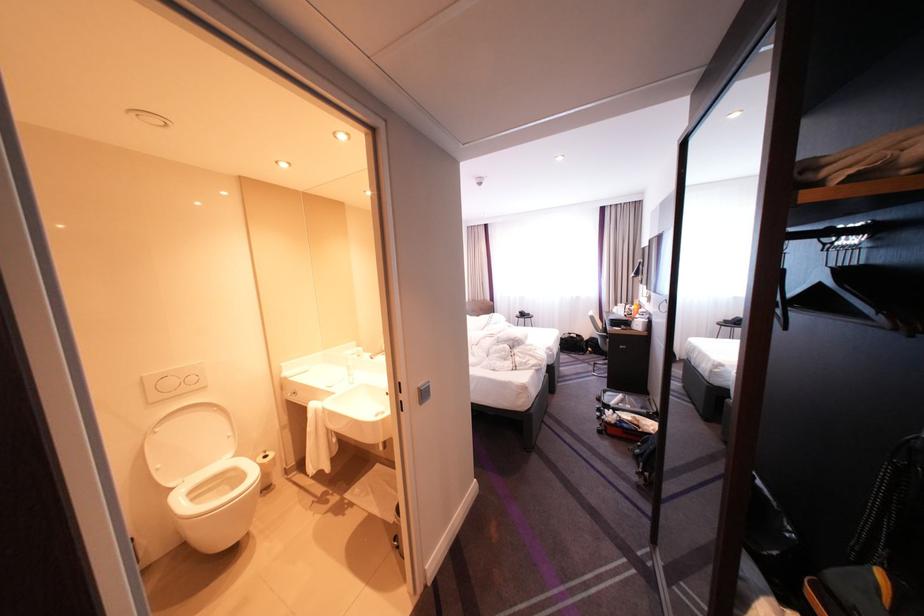
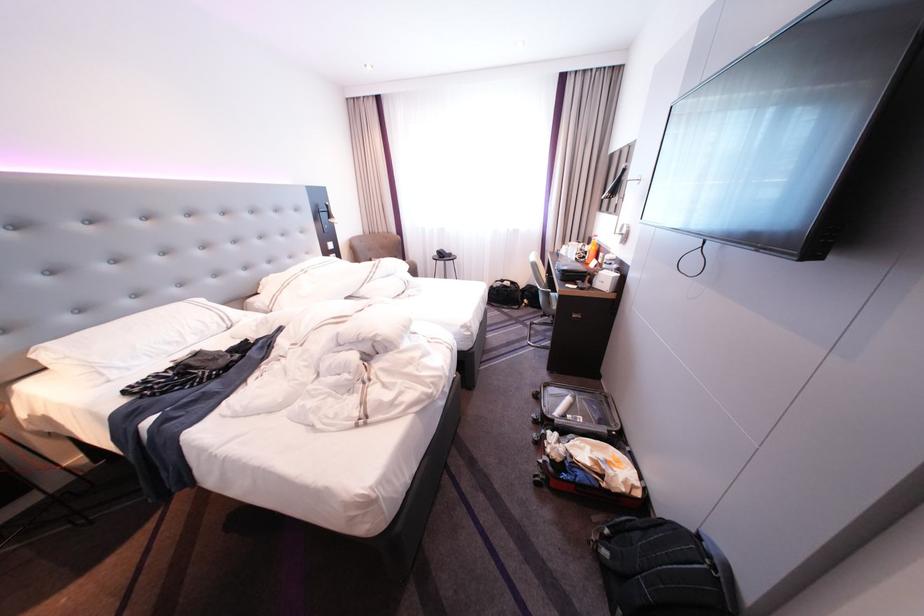
Locate, in the second image, the point that corresponds to (x=640, y=306) in the first image.

(593, 245)